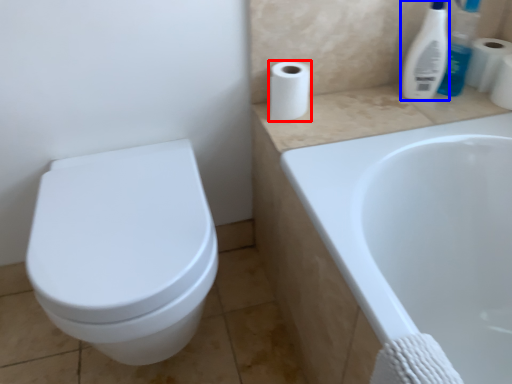
Question: Which object appears closest to the camera in this image, toilet paper (highlighted by a red box) or cleaning product (highlighted by a blue box)?

Choices:
 (A) toilet paper
 (B) cleaning product

Answer: (B)